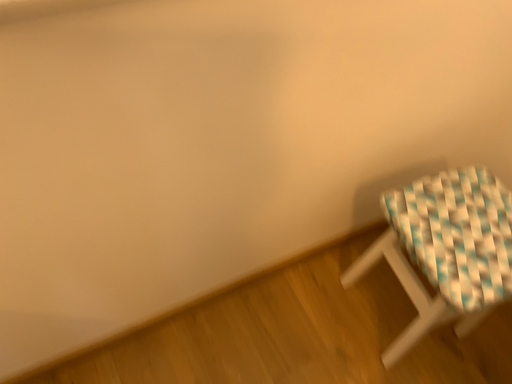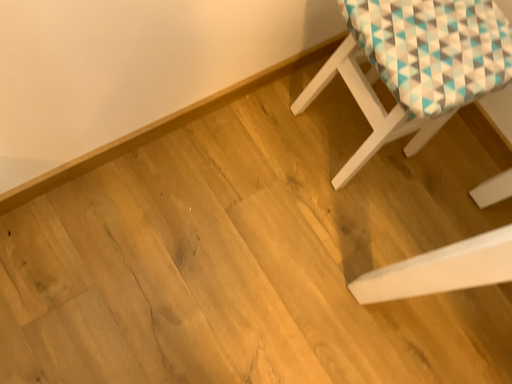
Question: Which way did the camera rotate in the video?

Choices:
 (A) rotated right
 (B) rotated left

Answer: (A)